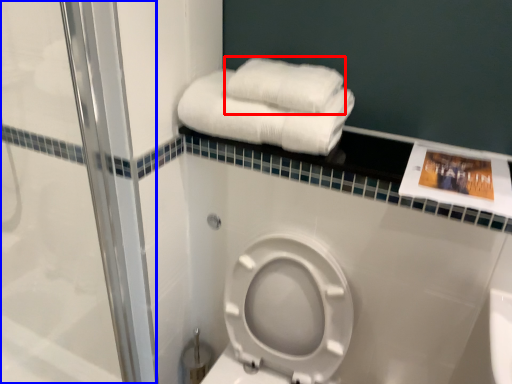
Question: Which of the following is the closest to the observer, towel (highlighted by a red box) or shower door (highlighted by a blue box)?

Choices:
 (A) towel
 (B) shower door

Answer: (B)